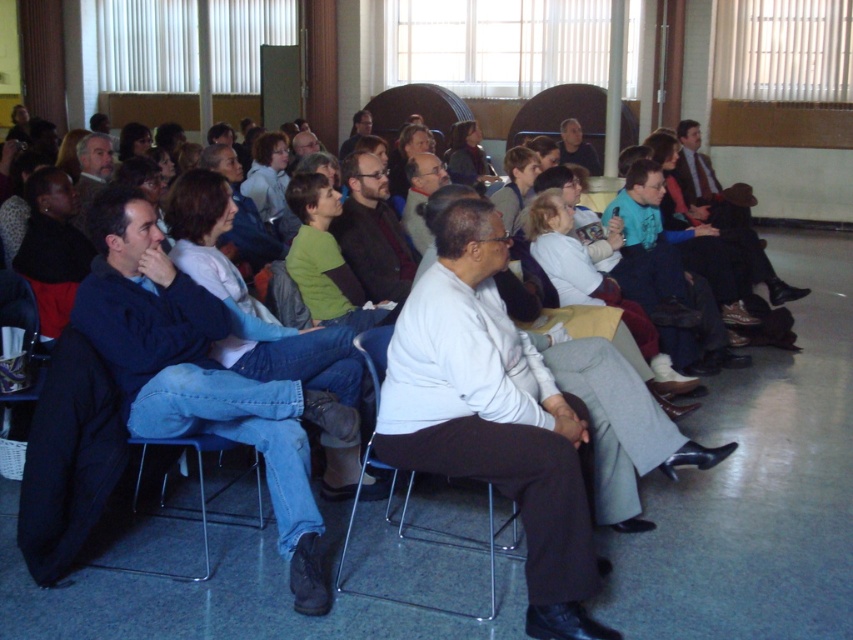
Question: Which point is farther to the camera?

Choices:
 (A) light green sweater at center
 (B) dark suit at center
 (C) metallic silver chair at center

Answer: (B)

Question: Among these objects, which one is farthest from the camera?

Choices:
 (A) light green sweater at center
 (B) white matte shirt at center
 (C) matte black jacket at upper center

Answer: (C)

Question: Can you confirm if metallic silver chair at center is thinner than light green sweater at center?

Choices:
 (A) no
 (B) yes

Answer: (A)

Question: Does dark suit at center appear under matte black jacket at upper center?

Choices:
 (A) no
 (B) yes

Answer: (B)

Question: Is light brown hair at center behind matte black jacket at upper center?

Choices:
 (A) no
 (B) yes

Answer: (A)

Question: Which of these objects is positioned farthest from the light green sweater at center?

Choices:
 (A) white matte shirt at center
 (B) matte black jacket at upper center

Answer: (B)